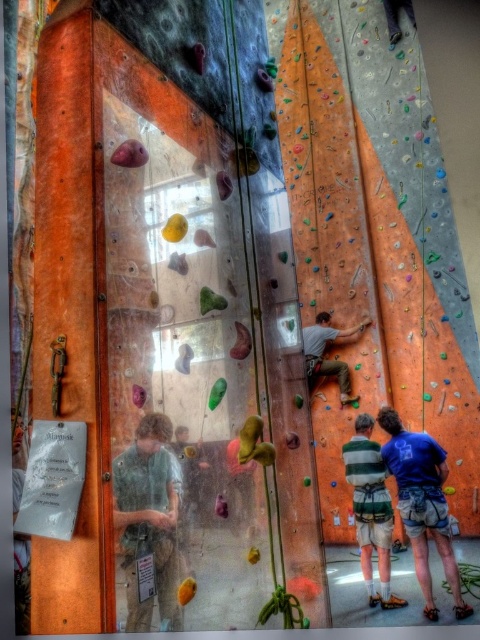
Consider the image. Does blue cotton shirt at lower right come in front of matte orange climbing gear at center?

Yes, it is.

What do you see at coordinates (421, 504) in the screenshot?
I see `blue cotton shirt at lower right` at bounding box center [421, 504].

You are a GUI agent. You are given a task and a screenshot of the screen. Output one action in this format:
    pyautogui.click(x=<x>, y=<y>)
    Task: Click on the blue cotton shirt at lower right
    The height and width of the screenshot is (640, 480).
    Given the screenshot: What is the action you would take?
    pyautogui.click(x=421, y=504)

What are the coordinates of `blue cotton shirt at lower right` in the screenshot? It's located at (421, 504).

Does point (365, 492) come in front of point (349, 337)?

Yes, point (365, 492) is in front of point (349, 337).

Does striped cotton shirt at center lie in front of matte orange climbing gear at center?

Yes.

Who is more distant from viewer, (376, 545) or (327, 330)?

The point (327, 330) is more distant.

The height and width of the screenshot is (640, 480). In order to click on striped cotton shirt at center in this screenshot , I will do `click(371, 508)`.

Locate an element on the screen. This screenshot has height=640, width=480. green fabric shirt at lower left is located at coordinates (148, 518).

Is green fabric shirt at lower left wider than striped cotton shirt at center?

No, green fabric shirt at lower left is not wider than striped cotton shirt at center.

Between point (162, 502) and point (383, 541), which one is positioned in front?

Positioned in front is point (162, 502).

Where is `green fabric shirt at lower left`? Image resolution: width=480 pixels, height=640 pixels. green fabric shirt at lower left is located at coordinates (148, 518).